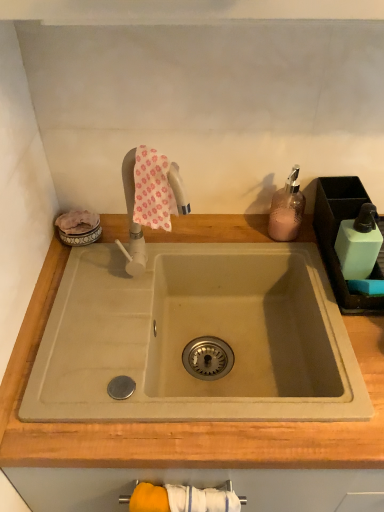
Find the location of a particular element. This screenshot has width=384, height=512. free location to the right of pink textured soap dispenser at upper right is located at coordinates (316, 234).